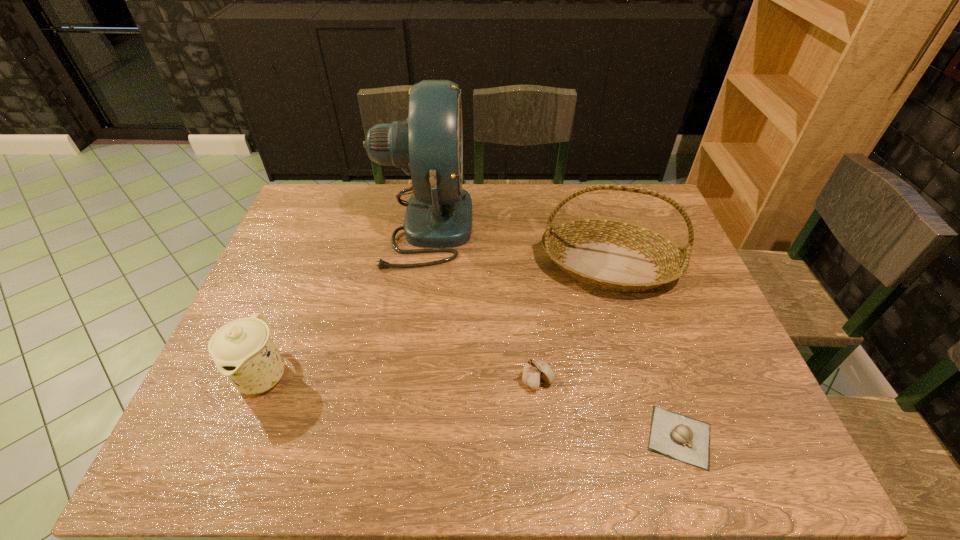
Locate an element on the screen. This screenshot has width=960, height=540. vacant area that satisfies the following two spatial constraints: 1. in front of the second object from left to right to blow air; 2. on the right side of the shortest object is located at coordinates (395, 437).

The image size is (960, 540). Find the location of `vacant point that satisfies the following two spatial constraints: 1. in front of the left garlic to blow air; 2. on the left side of the tallest object`. vacant point that satisfies the following two spatial constraints: 1. in front of the left garlic to blow air; 2. on the left side of the tallest object is located at coordinates (403, 381).

This screenshot has width=960, height=540. What are the coordinates of `vacant position in the image that satisfies the following two spatial constraints: 1. on the spout of the leftmost object; 2. on the left side of the shorter garlic` in the screenshot? It's located at (238, 437).

The height and width of the screenshot is (540, 960). Find the location of `free point that satisfies the following two spatial constraints: 1. on the back side of the second tallest object; 2. in front of the fourth object from right to left to blow air`. free point that satisfies the following two spatial constraints: 1. on the back side of the second tallest object; 2. in front of the fourth object from right to left to blow air is located at coordinates (597, 225).

The width and height of the screenshot is (960, 540). What are the coordinates of `vacant region that satisfies the following two spatial constraints: 1. on the spout of the third shortest object; 2. on the right side of the shortest object` in the screenshot? It's located at (238, 437).

Locate an element on the screen. The image size is (960, 540). free space that satisfies the following two spatial constraints: 1. in front of the fourth object from right to left to blow air; 2. on the right side of the left garlic is located at coordinates coord(403,381).

This screenshot has height=540, width=960. Find the location of `vacant space that satisfies the following two spatial constraints: 1. in front of the fan to blow air; 2. on the back side of the right garlic`. vacant space that satisfies the following two spatial constraints: 1. in front of the fan to blow air; 2. on the back side of the right garlic is located at coordinates (395, 437).

The width and height of the screenshot is (960, 540). Find the location of `vacant area in the image that satisfies the following two spatial constraints: 1. on the back side of the shorter garlic; 2. in front of the second object from left to right to blow air`. vacant area in the image that satisfies the following two spatial constraints: 1. on the back side of the shorter garlic; 2. in front of the second object from left to right to blow air is located at coordinates (610, 225).

The width and height of the screenshot is (960, 540). I want to click on vacant region that satisfies the following two spatial constraints: 1. on the spout of the leftmost object; 2. on the left side of the shorter garlic, so click(x=238, y=437).